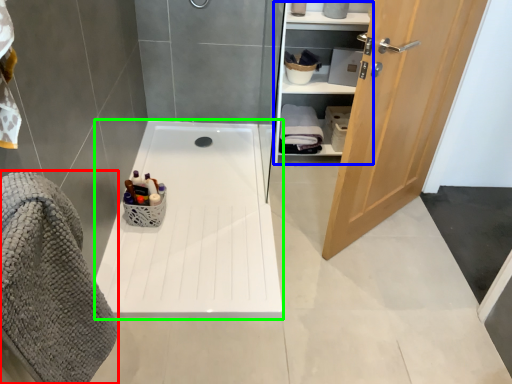
Question: Which object is positioned farthest from bath towel (highlighted by a red box)? Select from closet (highlighted by a blue box) and bath (highlighted by a green box).

Choices:
 (A) closet
 (B) bath

Answer: (A)